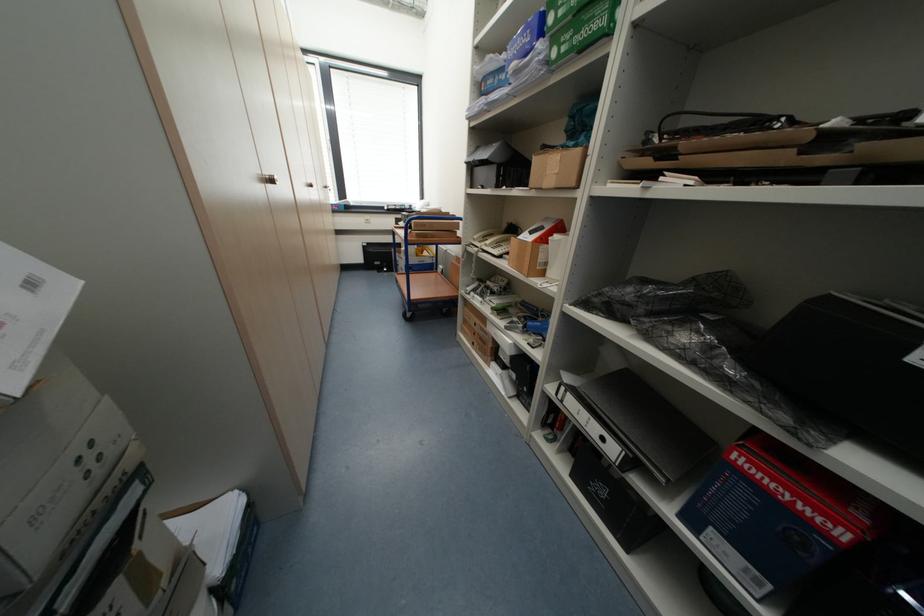
Identify the location of cabinet door handle. (270, 179).